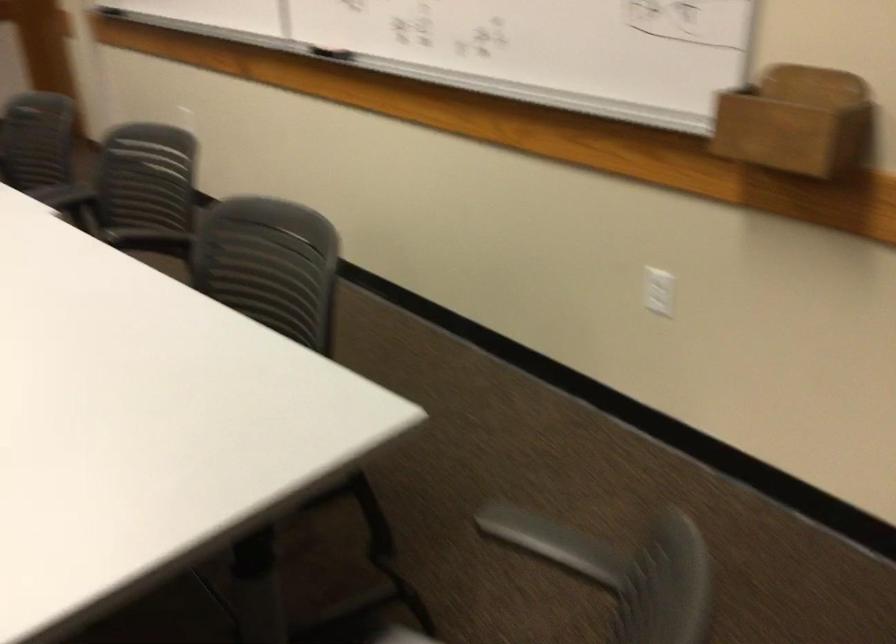
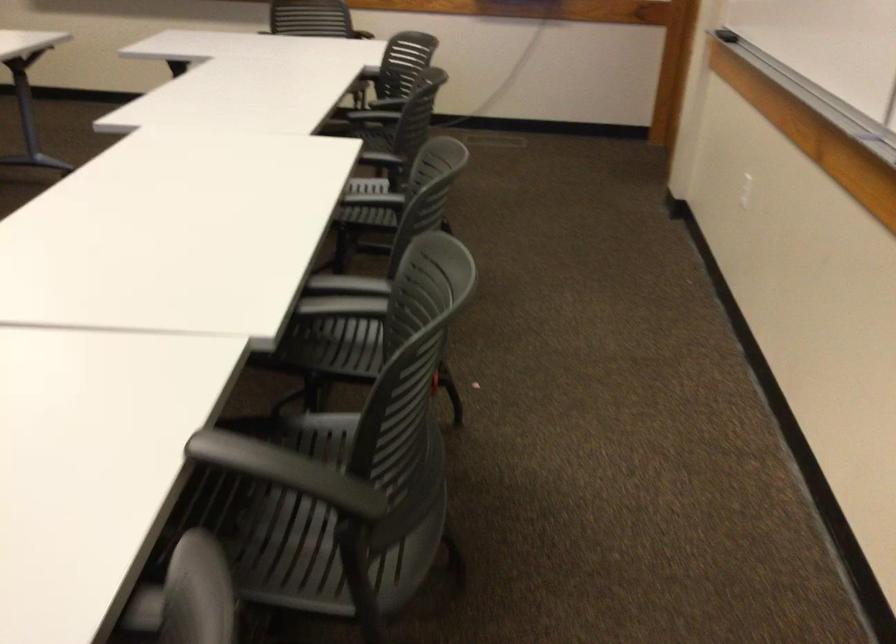
Locate, in the second image, the point that corresponds to point 69,196 in the first image.

(343, 297)